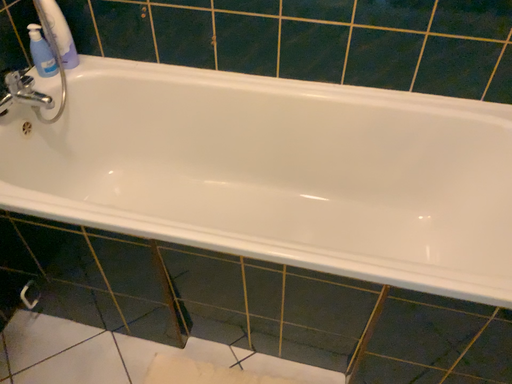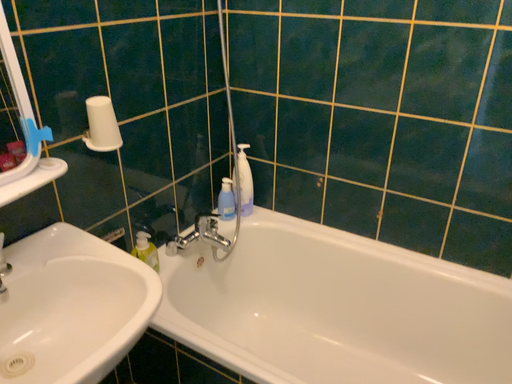
Question: How did the camera likely rotate when shooting the video?

Choices:
 (A) rotated right
 (B) rotated left

Answer: (B)